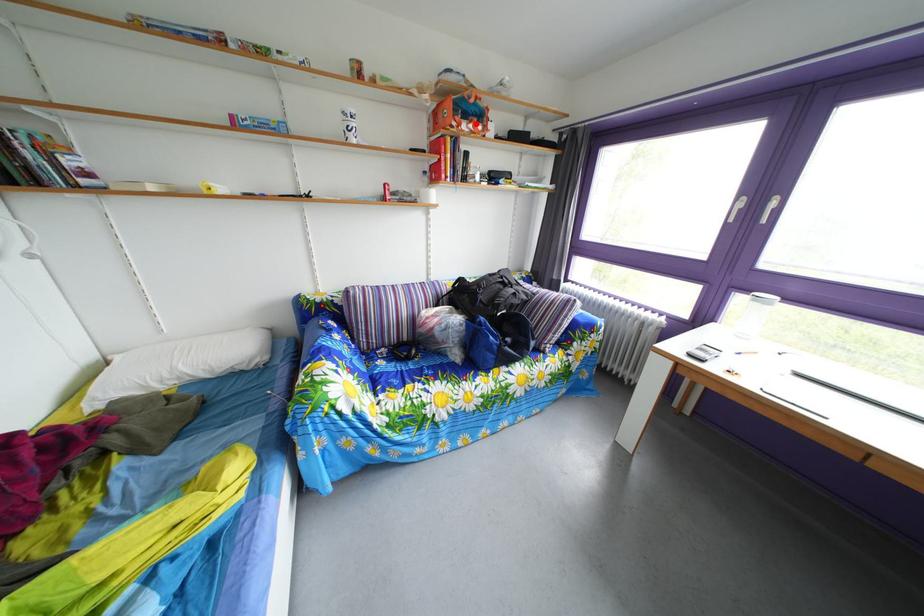
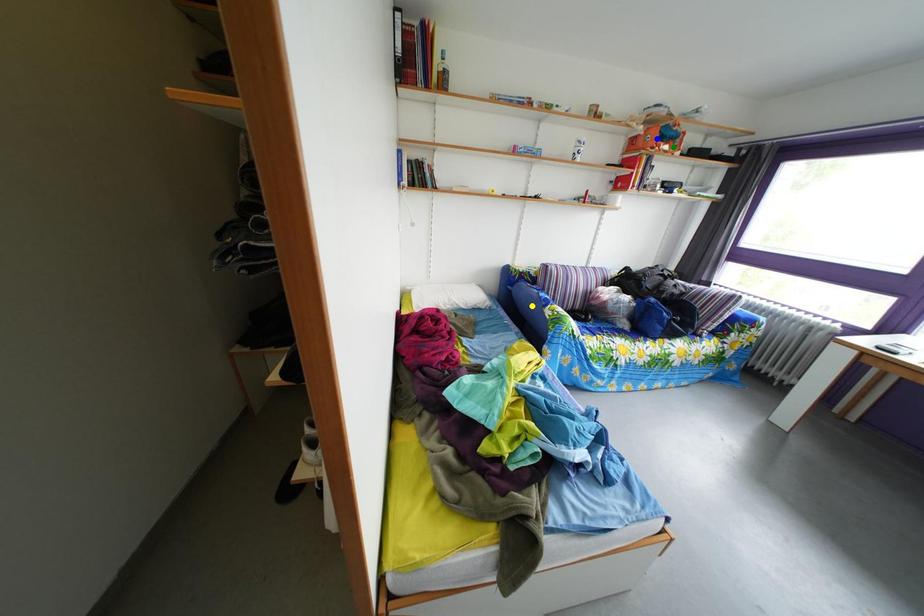
Question: I am providing you with two images of the same scene from different viewpoints. A red point is marked on the first image. You are given multiple points on the second image. Which mark in image 2 goes with the point in image 1?

Choices:
 (A) yellow point
 (B) blue point
 (C) green point

Answer: (C)